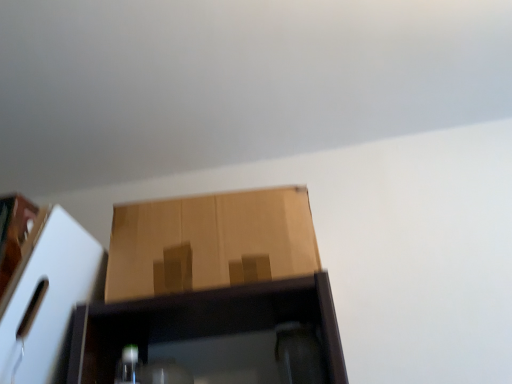
This screenshot has width=512, height=384. Find the location of `matte brown cardboard box at left, arranged as the first cardboard box when viewed from the left`. matte brown cardboard box at left, arranged as the first cardboard box when viewed from the left is located at coordinates (48, 299).

What is the approximate height of matte brown cardboard box at left, arranged as the first cardboard box when viewed from the left?

matte brown cardboard box at left, arranged as the first cardboard box when viewed from the left, is 12.26 inches tall.

What do you see at coordinates (48, 299) in the screenshot? I see `matte brown cardboard box at left, the 2th cardboard box viewed from the right` at bounding box center [48, 299].

Identify the location of brown cardboard box at center, which appears as the second cardboard box when viewed from the left. (210, 242).

How much space does brown cardboard box at center, positioned as the 1th cardboard box in right-to-left order, occupy horizontally?

brown cardboard box at center, positioned as the 1th cardboard box in right-to-left order, is 12.12 inches in width.

Image resolution: width=512 pixels, height=384 pixels. What do you see at coordinates (210, 242) in the screenshot?
I see `brown cardboard box at center, positioned as the 1th cardboard box in right-to-left order` at bounding box center [210, 242].

Identify the location of matte brown cardboard box at left, arranged as the first cardboard box when viewed from the left. (48, 299).

Between brown cardboard box at center, which appears as the second cardboard box when viewed from the left, and matte brown cardboard box at left, arranged as the first cardboard box when viewed from the left, which one appears on the left side from the viewer's perspective?

matte brown cardboard box at left, arranged as the first cardboard box when viewed from the left, is more to the left.

Considering their positions, is brown cardboard box at center, which appears as the second cardboard box when viewed from the left, located in front of or behind matte brown cardboard box at left, arranged as the first cardboard box when viewed from the left?

brown cardboard box at center, which appears as the second cardboard box when viewed from the left, is positioned farther from the viewer than matte brown cardboard box at left, arranged as the first cardboard box when viewed from the left.

Is point (234, 284) positioned in front of point (64, 254)?

That is False.

In the scene shown: From the image's perspective, which one is positioned lower, brown cardboard box at center, which appears as the second cardboard box when viewed from the left, or matte brown cardboard box at left, the 2th cardboard box viewed from the right?

matte brown cardboard box at left, the 2th cardboard box viewed from the right, from the image's perspective.

From a real-world perspective, is brown cardboard box at center, positioned as the 1th cardboard box in right-to-left order, located beneath matte brown cardboard box at left, the 2th cardboard box viewed from the right?

No.

Which of these two, brown cardboard box at center, positioned as the 1th cardboard box in right-to-left order, or matte brown cardboard box at left, the 2th cardboard box viewed from the right, is thinner?

Thinner between the two is brown cardboard box at center, positioned as the 1th cardboard box in right-to-left order.

Considering the sizes of objects brown cardboard box at center, positioned as the 1th cardboard box in right-to-left order, and matte brown cardboard box at left, the 2th cardboard box viewed from the right, in the image provided, who is taller, brown cardboard box at center, positioned as the 1th cardboard box in right-to-left order, or matte brown cardboard box at left, the 2th cardboard box viewed from the right,?

matte brown cardboard box at left, the 2th cardboard box viewed from the right.

Is brown cardboard box at center, positioned as the 1th cardboard box in right-to-left order, bigger or smaller than matte brown cardboard box at left, arranged as the first cardboard box when viewed from the left?

In the image, brown cardboard box at center, positioned as the 1th cardboard box in right-to-left order, appears to be larger than matte brown cardboard box at left, arranged as the first cardboard box when viewed from the left.

Would you say brown cardboard box at center, positioned as the 1th cardboard box in right-to-left order, is outside matte brown cardboard box at left, arranged as the first cardboard box when viewed from the left?

Yes, brown cardboard box at center, positioned as the 1th cardboard box in right-to-left order, is located beyond the bounds of matte brown cardboard box at left, arranged as the first cardboard box when viewed from the left.

Can you see brown cardboard box at center, positioned as the 1th cardboard box in right-to-left order, touching matte brown cardboard box at left, arranged as the first cardboard box when viewed from the left?

No, brown cardboard box at center, positioned as the 1th cardboard box in right-to-left order, is not with matte brown cardboard box at left, arranged as the first cardboard box when viewed from the left.

Does brown cardboard box at center, positioned as the 1th cardboard box in right-to-left order, turn towards matte brown cardboard box at left, arranged as the first cardboard box when viewed from the left?

No, brown cardboard box at center, positioned as the 1th cardboard box in right-to-left order, is not facing towards matte brown cardboard box at left, arranged as the first cardboard box when viewed from the left.

How much distance is there between brown cardboard box at center, positioned as the 1th cardboard box in right-to-left order, and matte brown cardboard box at left, the 2th cardboard box viewed from the right?

A: brown cardboard box at center, positioned as the 1th cardboard box in right-to-left order, is 6.82 inches away from matte brown cardboard box at left, the 2th cardboard box viewed from the right.

Identify the location of cardboard box behind the matte brown cardboard box at left, arranged as the first cardboard box when viewed from the left. The image size is (512, 384). (210, 242).

Based on their positions, is matte brown cardboard box at left, the 2th cardboard box viewed from the right, located to the left or right of brown cardboard box at center, which appears as the second cardboard box when viewed from the left?

In the image, matte brown cardboard box at left, the 2th cardboard box viewed from the right, appears on the left side of brown cardboard box at center, which appears as the second cardboard box when viewed from the left.

From the picture: Is matte brown cardboard box at left, the 2th cardboard box viewed from the right, further to camera compared to brown cardboard box at center, positioned as the 1th cardboard box in right-to-left order?

No, it is in front of brown cardboard box at center, positioned as the 1th cardboard box in right-to-left order.

Which point is more distant from viewer, (x=81, y=254) or (x=190, y=232)?

The point (x=190, y=232) is farther.

From the image's perspective, is matte brown cardboard box at left, the 2th cardboard box viewed from the right, under brown cardboard box at center, which appears as the second cardboard box when viewed from the left?

Yes, from the image's perspective, matte brown cardboard box at left, the 2th cardboard box viewed from the right, is beneath brown cardboard box at center, which appears as the second cardboard box when viewed from the left.

From a real-world perspective, is matte brown cardboard box at left, arranged as the first cardboard box when viewed from the left, located beneath brown cardboard box at center, which appears as the second cardboard box when viewed from the left?

Yes, from a real-world perspective, matte brown cardboard box at left, arranged as the first cardboard box when viewed from the left, is beneath brown cardboard box at center, which appears as the second cardboard box when viewed from the left.

Considering the sizes of objects matte brown cardboard box at left, arranged as the first cardboard box when viewed from the left, and brown cardboard box at center, which appears as the second cardboard box when viewed from the left, in the image provided, who is thinner, matte brown cardboard box at left, arranged as the first cardboard box when viewed from the left, or brown cardboard box at center, which appears as the second cardboard box when viewed from the left,?

With smaller width is brown cardboard box at center, which appears as the second cardboard box when viewed from the left.

In terms of height, does matte brown cardboard box at left, arranged as the first cardboard box when viewed from the left, look taller or shorter compared to brown cardboard box at center, positioned as the 1th cardboard box in right-to-left order?

matte brown cardboard box at left, arranged as the first cardboard box when viewed from the left, is taller than brown cardboard box at center, positioned as the 1th cardboard box in right-to-left order.

Which of these two, matte brown cardboard box at left, arranged as the first cardboard box when viewed from the left, or brown cardboard box at center, which appears as the second cardboard box when viewed from the left, is smaller?

With smaller size is matte brown cardboard box at left, arranged as the first cardboard box when viewed from the left.

Would you say matte brown cardboard box at left, the 2th cardboard box viewed from the right, is inside or outside brown cardboard box at center, positioned as the 1th cardboard box in right-to-left order?

matte brown cardboard box at left, the 2th cardboard box viewed from the right, cannot be found inside brown cardboard box at center, positioned as the 1th cardboard box in right-to-left order.

Are matte brown cardboard box at left, arranged as the first cardboard box when viewed from the left, and brown cardboard box at center, positioned as the 1th cardboard box in right-to-left order, located far from each other?

matte brown cardboard box at left, arranged as the first cardboard box when viewed from the left, is near brown cardboard box at center, positioned as the 1th cardboard box in right-to-left order, not far away.

Based on the photo, is brown cardboard box at center, which appears as the second cardboard box when viewed from the left, at the back of matte brown cardboard box at left, arranged as the first cardboard box when viewed from the left?

No, matte brown cardboard box at left, arranged as the first cardboard box when viewed from the left, is not facing the opposite direction of brown cardboard box at center, which appears as the second cardboard box when viewed from the left.

Find the location of a particular element. cardboard box above the matte brown cardboard box at left, arranged as the first cardboard box when viewed from the left (from a real-world perspective) is located at coordinates (210, 242).

Locate an element on the screen. The height and width of the screenshot is (384, 512). cardboard box on the left side of brown cardboard box at center, positioned as the 1th cardboard box in right-to-left order is located at coordinates [x=48, y=299].

At what (x,y) coordinates should I click in order to perform the action: click on cardboard box located behind the matte brown cardboard box at left, arranged as the first cardboard box when viewed from the left. Please return your answer as a coordinate pair (x, y). Looking at the image, I should click on coord(210,242).